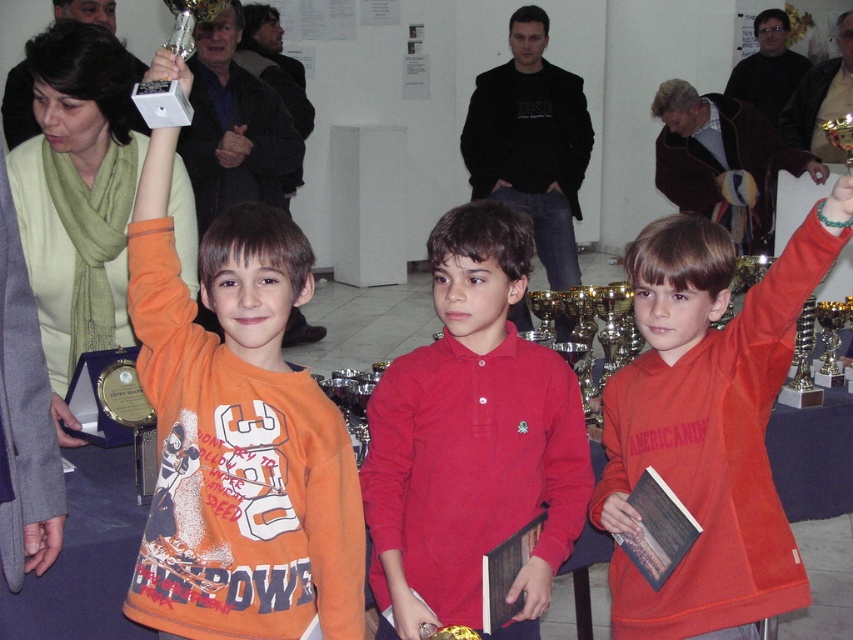
Question: Is orange cotton shirt at left wider than metallic trophy at upper left?

Choices:
 (A) yes
 (B) no

Answer: (A)

Question: Can you confirm if orange cotton shirt at left is smaller than green beaded bracelet at upper center?

Choices:
 (A) no
 (B) yes

Answer: (A)

Question: Estimate the real-world distances between objects in this image. Which object is farther from the orange cotton shirt at left?

Choices:
 (A) orange fleece sweatshirt at upper right
 (B) metallic trophy at upper left
 (C) red matte shirt at center

Answer: (A)

Question: Which of the following is the farthest from the observer?

Choices:
 (A) (849, 195)
 (B) (172, 65)
 (C) (305, 248)

Answer: (B)

Question: Which of the following is the farthest from the observer?

Choices:
 (A) green beaded bracelet at upper center
 (B) orange cotton shirt at left
 (C) red matte shirt at center

Answer: (C)

Question: Is red matte shirt at center wider than green beaded bracelet at upper center?

Choices:
 (A) yes
 (B) no

Answer: (A)